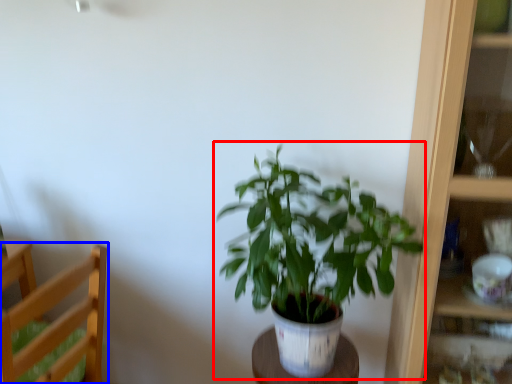
Question: Which object is further to the camera taking this photo, houseplant (highlighted by a red box) or furniture (highlighted by a blue box)?

Choices:
 (A) houseplant
 (B) furniture

Answer: (B)